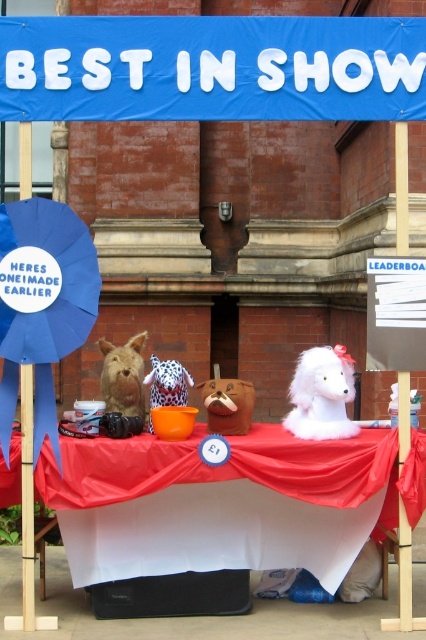
Question: Does blue fabric canopy at upper center have a larger size compared to spotted plush toy at center?

Choices:
 (A) no
 (B) yes

Answer: (B)

Question: Can you confirm if brown plush dog at center is wider than spotted plush toy at center?

Choices:
 (A) yes
 (B) no

Answer: (A)

Question: Is blue fabric canopy at upper center thinner than spotted plush toy at center?

Choices:
 (A) yes
 (B) no

Answer: (B)

Question: Considering the real-world distances, which object is closest to the brown plush dog at center?

Choices:
 (A) white fabric table at center
 (B) white fluffy stuffed horse at center
 (C) blue fabric canopy at upper center
 (D) spotted plush toy at center

Answer: (D)

Question: Which is nearer to the white fluffy stuffed horse at center?

Choices:
 (A) blue fabric canopy at upper center
 (B) fuzzy brown stuffed animal at center
 (C) white fabric table at center
 (D) spotted plush toy at center

Answer: (C)

Question: Which point is closer to the camera taking this photo?

Choices:
 (A) (131, 406)
 (B) (169, 81)

Answer: (B)